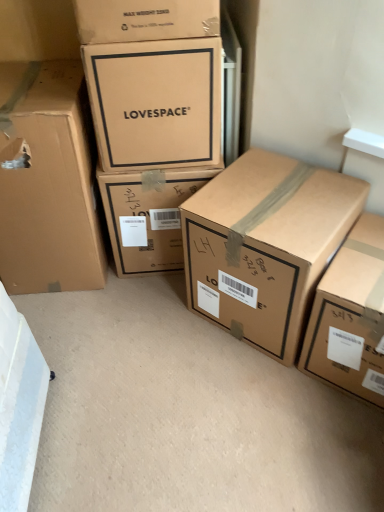
What do you see at coordinates (265, 245) in the screenshot? Image resolution: width=384 pixels, height=512 pixels. I see `brown cardboard box at center, which ranks as the 4th box in left-to-right order` at bounding box center [265, 245].

The image size is (384, 512). I want to click on brown cardboard box at lower right, the 5th box when ordered from left to right, so click(351, 316).

Identify the location of matte cardboard box at left, marked as the 1th box in a left-to-right arrangement. (48, 181).

Is matte cardboard box at upper center, placed as the second box when sorted from left to right, positioned far away from matte cardboard box at left, marked as the 1th box in a left-to-right arrangement?

No, there isn't a large distance between matte cardboard box at upper center, placed as the second box when sorted from left to right, and matte cardboard box at left, marked as the 1th box in a left-to-right arrangement.

Between matte cardboard box at upper center, the fourth box positioned from the right, and matte cardboard box at left, marked as the 1th box in a left-to-right arrangement, which one has larger width?

With larger width is matte cardboard box at left, marked as the 1th box in a left-to-right arrangement.

Is point (131, 100) positioned behind point (78, 72)?

No, it is in front of (78, 72).

This screenshot has width=384, height=512. Identify the location of the 1st box positioned below the matte cardboard box at upper center, the fourth box positioned from the right (from the image's perspective). (48, 181).

Does brown cardboard box at center, the 2th box in the right-to-left sequence, touch matte cardboard box at upper center, placed as the second box when sorted from left to right?

No, brown cardboard box at center, the 2th box in the right-to-left sequence, is not with matte cardboard box at upper center, placed as the second box when sorted from left to right.

From the image's perspective, is brown cardboard box at center, which ranks as the 4th box in left-to-right order, above or below matte cardboard box at upper center, the fourth box positioned from the right?

Clearly, from the image's perspective, brown cardboard box at center, which ranks as the 4th box in left-to-right order, is below matte cardboard box at upper center, the fourth box positioned from the right.

From a real-world perspective, count 2nd boxs downward from the matte cardboard box at upper center, the fourth box positioned from the right, and point to it. Please provide its 2D coordinates.

[(265, 245)]

Is matte cardboard box at upper center, placed as the second box when sorted from left to right, taller than brown cardboard box at center, the 2th box in the right-to-left sequence?

No, matte cardboard box at upper center, placed as the second box when sorted from left to right, is not taller than brown cardboard box at center, the 2th box in the right-to-left sequence.

Considering the points (184, 76) and (276, 183), which point is behind, point (184, 76) or point (276, 183)?

The point (276, 183) is behind.

Choose the correct answer: Is matte cardboard box at upper center, placed as the second box when sorted from left to right, inside brown cardboard box at center, the 2th box in the right-to-left sequence, or outside it?

matte cardboard box at upper center, placed as the second box when sorted from left to right, exists outside the volume of brown cardboard box at center, the 2th box in the right-to-left sequence.

Is matte cardboard box at upper center, placed as the second box when sorted from left to right, facing away from brown cardboard box at center, the 2th box in the right-to-left sequence?

No.

From a real-world perspective, does brown cardboard box at center, the 2th box in the right-to-left sequence, stand above matte cardboard box at left, the 5th box in the right-to-left sequence?

Actually, brown cardboard box at center, the 2th box in the right-to-left sequence, is physically below matte cardboard box at left, the 5th box in the right-to-left sequence, in the real world.

Between brown cardboard box at center, the 2th box in the right-to-left sequence, and matte cardboard box at left, the 5th box in the right-to-left sequence, which one has less height?

brown cardboard box at center, the 2th box in the right-to-left sequence, is shorter.

Is brown cardboard box at center, the 2th box in the right-to-left sequence, situated inside matte cardboard box at left, the 5th box in the right-to-left sequence, or outside?

brown cardboard box at center, the 2th box in the right-to-left sequence, is spatially situated outside matte cardboard box at left, the 5th box in the right-to-left sequence.

Is brown cardboard box at center, which ranks as the 4th box in left-to-right order, facing away from matte cardboard box at left, the 5th box in the right-to-left sequence?

No, matte cardboard box at left, the 5th box in the right-to-left sequence, is not at the back of brown cardboard box at center, which ranks as the 4th box in left-to-right order.

In the scene shown: Visually, is matte cardboard box at center, the 3th box in the right-to-left sequence, positioned to the left or to the right of brown cardboard box at lower right, which is counted as the first box, starting from the right?

matte cardboard box at center, the 3th box in the right-to-left sequence, is to the left of brown cardboard box at lower right, which is counted as the first box, starting from the right.

You are a GUI agent. You are given a task and a screenshot of the screen. Output one action in this format:
    pyautogui.click(x=<x>, y=<y>)
    Task: Click on the box that is the 4th one when counting forward from the matte cardboard box at center, the 3th box in the right-to-left sequence
    Image resolution: width=384 pixels, height=512 pixels.
    Given the screenshot: What is the action you would take?
    pyautogui.click(x=351, y=316)

Looking at this image, from the image's perspective, between matte cardboard box at center, positioned as the third box in left-to-right order, and brown cardboard box at lower right, which is counted as the first box, starting from the right, which one is located above?

matte cardboard box at center, positioned as the third box in left-to-right order, from the image's perspective.

From the image's perspective, which object appears higher, brown cardboard box at center, the 2th box in the right-to-left sequence, or matte cardboard box at center, the 3th box in the right-to-left sequence?

From the image's view, matte cardboard box at center, the 3th box in the right-to-left sequence, is above.

Is brown cardboard box at center, the 2th box in the right-to-left sequence, behind matte cardboard box at center, the 3th box in the right-to-left sequence?

No, it is not.

From a real-world perspective, between brown cardboard box at center, the 2th box in the right-to-left sequence, and matte cardboard box at center, the 3th box in the right-to-left sequence, who is vertically lower?

In real-world perspective, matte cardboard box at center, the 3th box in the right-to-left sequence, is lower.

In the scene shown: Is brown cardboard box at center, which ranks as the 4th box in left-to-right order, located outside brown cardboard box at lower right, the 5th box when ordered from left to right?

That's correct, brown cardboard box at center, which ranks as the 4th box in left-to-right order, is outside of brown cardboard box at lower right, the 5th box when ordered from left to right.

Considering the sizes of objects brown cardboard box at center, which ranks as the 4th box in left-to-right order, and brown cardboard box at lower right, which is counted as the first box, starting from the right, in the image provided, who is wider, brown cardboard box at center, which ranks as the 4th box in left-to-right order, or brown cardboard box at lower right, which is counted as the first box, starting from the right,?

With larger width is brown cardboard box at center, which ranks as the 4th box in left-to-right order.

Considering the positions of objects brown cardboard box at center, which ranks as the 4th box in left-to-right order, and brown cardboard box at lower right, the 5th box when ordered from left to right, in the image provided, who is more to the left, brown cardboard box at center, which ranks as the 4th box in left-to-right order, or brown cardboard box at lower right, the 5th box when ordered from left to right,?

Positioned to the left is brown cardboard box at center, which ranks as the 4th box in left-to-right order.

What are the coordinates of `the 1st box to the right when counting from the matte cardboard box at left, the 5th box in the right-to-left sequence` in the screenshot? It's located at point(155,103).

From the image's perspective, starting from the brown cardboard box at center, which ranks as the 4th box in left-to-right order, which box is the 3rd one above? Please provide its 2D coordinates.

[(155, 103)]

From the image, which object appears to be nearer to brown cardboard box at lower right, the 5th box when ordered from left to right, brown cardboard box at center, the 2th box in the right-to-left sequence, or matte cardboard box at center, positioned as the third box in left-to-right order?

brown cardboard box at center, the 2th box in the right-to-left sequence, lies closer to brown cardboard box at lower right, the 5th box when ordered from left to right, than the other object.

From the image, which object appears to be nearer to brown cardboard box at center, which ranks as the 4th box in left-to-right order, matte cardboard box at upper center, placed as the second box when sorted from left to right, or matte cardboard box at left, the 5th box in the right-to-left sequence?

Based on the image, matte cardboard box at upper center, placed as the second box when sorted from left to right, appears to be nearer to brown cardboard box at center, which ranks as the 4th box in left-to-right order.

Looking at the image, which one is located closer to matte cardboard box at upper center, placed as the second box when sorted from left to right, matte cardboard box at left, marked as the 1th box in a left-to-right arrangement, or brown cardboard box at lower right, which is counted as the first box, starting from the right?

Among the two, matte cardboard box at left, marked as the 1th box in a left-to-right arrangement, is located nearer to matte cardboard box at upper center, placed as the second box when sorted from left to right.

Looking at the image, which one is located further to brown cardboard box at center, the 2th box in the right-to-left sequence, brown cardboard box at lower right, the 5th box when ordered from left to right, or matte cardboard box at upper center, the fourth box positioned from the right?

The object further to brown cardboard box at center, the 2th box in the right-to-left sequence, is matte cardboard box at upper center, the fourth box positioned from the right.

Based on their spatial positions, is brown cardboard box at lower right, the 5th box when ordered from left to right, or matte cardboard box at left, marked as the 1th box in a left-to-right arrangement, closer to brown cardboard box at center, which ranks as the 4th box in left-to-right order?

brown cardboard box at lower right, the 5th box when ordered from left to right, is positioned closer to the anchor brown cardboard box at center, which ranks as the 4th box in left-to-right order.

Looking at the image, which one is located closer to matte cardboard box at upper center, placed as the second box when sorted from left to right, brown cardboard box at center, the 2th box in the right-to-left sequence, or brown cardboard box at lower right, the 5th box when ordered from left to right?

brown cardboard box at center, the 2th box in the right-to-left sequence, is closer to matte cardboard box at upper center, placed as the second box when sorted from left to right.

When comparing their distances from matte cardboard box at upper center, placed as the second box when sorted from left to right, does matte cardboard box at center, positioned as the third box in left-to-right order, or brown cardboard box at center, which ranks as the 4th box in left-to-right order, seem further?

brown cardboard box at center, which ranks as the 4th box in left-to-right order.

Estimate the real-world distances between objects in this image. Which object is further from brown cardboard box at center, which ranks as the 4th box in left-to-right order, matte cardboard box at center, the 3th box in the right-to-left sequence, or matte cardboard box at left, the 5th box in the right-to-left sequence?

matte cardboard box at left, the 5th box in the right-to-left sequence, is further to brown cardboard box at center, which ranks as the 4th box in left-to-right order.

This screenshot has width=384, height=512. I want to click on box between matte cardboard box at left, marked as the 1th box in a left-to-right arrangement, and matte cardboard box at center, positioned as the third box in left-to-right order, from left to right, so click(x=155, y=103).

This screenshot has width=384, height=512. Find the location of `box between matte cardboard box at center, the 3th box in the right-to-left sequence, and brown cardboard box at lower right, which is counted as the first box, starting from the right, from left to right`. box between matte cardboard box at center, the 3th box in the right-to-left sequence, and brown cardboard box at lower right, which is counted as the first box, starting from the right, from left to right is located at coordinates (265, 245).